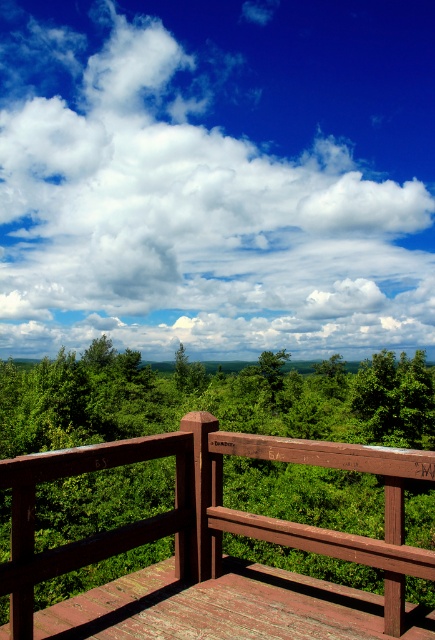
Question: Which object appears closest to the camera in this image?

Choices:
 (A) brown wooden rail at center
 (B) white fluffy cloud at upper center

Answer: (A)

Question: Which point appears closest to the camera in this image?

Choices:
 (A) (384, 577)
 (B) (120, 60)

Answer: (A)

Question: Does white fluffy cloud at upper center appear over brown wooden rail at center?

Choices:
 (A) yes
 (B) no

Answer: (A)

Question: Does white fluffy cloud at upper center appear under brown wooden rail at center?

Choices:
 (A) no
 (B) yes

Answer: (A)

Question: Is white fluffy cloud at upper center to the left of brown wooden rail at center from the viewer's perspective?

Choices:
 (A) no
 (B) yes

Answer: (B)